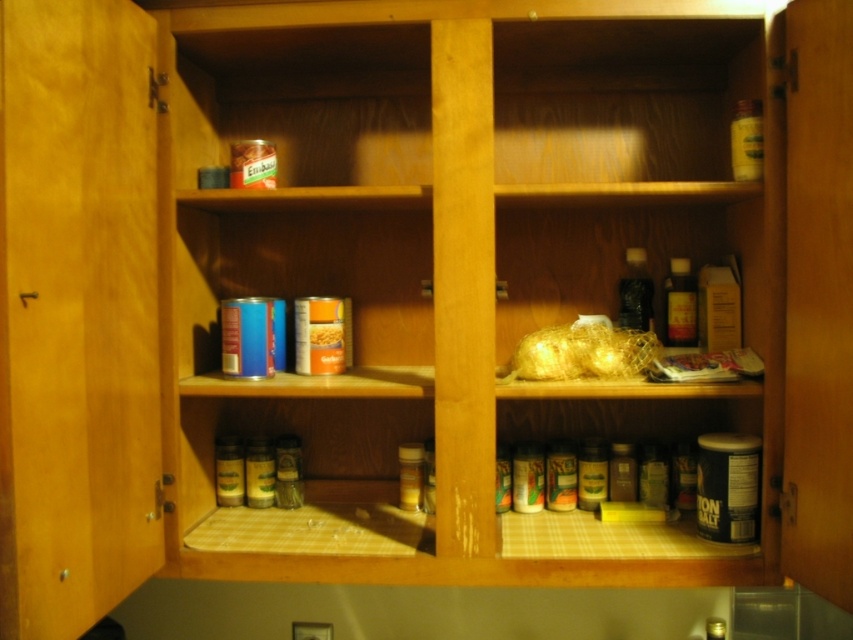
You are standing in front of the open wooden cabinet and want to reach two points inside it. The first point is at coordinate point(759, 177) and the second is at point(625, 308). Which point is easier to reach without moving your position?

Point(759, 177) is closer to the camera than point(625, 308), so it is easier to reach without moving your position.

You are organizing items in the kitchen cabinet described. You need to place a new bottle of vinegar that must be placed on the right side of the cabinet. The bottle is the same size as the translucent amber glass bottle at upper right. Where should you place it so it doesn not overlap with existing items?

The translucent amber glass bottle at upper right is located at point (680, 304). Since the new vinegar bottle is the same size, place it to the right of this position on the upper right shelf to avoid overlapping with existing items.